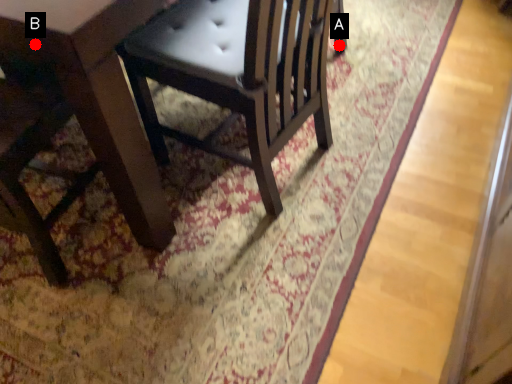
Question: Two points are circled on the image, labeled by A and B beside each circle. Which point is further to the camera?

Choices:
 (A) A is further
 (B) B is further

Answer: (A)